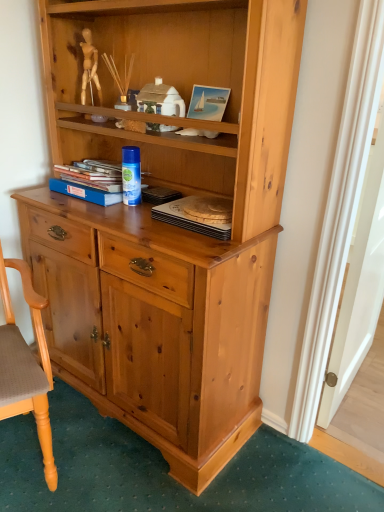
Question: From the image's perspective, is blue hardcover book at center, the 2th book positioned from the right, on wooden polished chair at lower left?

Choices:
 (A) yes
 (B) no

Answer: (A)

Question: Could you tell me if blue hardcover book at center, the 2th book positioned from the right, is facing wooden polished chair at lower left?

Choices:
 (A) yes
 (B) no

Answer: (A)

Question: Is blue hardcover book at center, the 2th book positioned from the right, at the right side of wooden polished chair at lower left?

Choices:
 (A) yes
 (B) no

Answer: (A)

Question: From a real-world perspective, is blue hardcover book at center, which is the 1th book in left-to-right order, on wooden polished chair at lower left?

Choices:
 (A) yes
 (B) no

Answer: (A)

Question: Is blue hardcover book at center, the 2th book positioned from the right, at the left side of wooden polished chair at lower left?

Choices:
 (A) yes
 (B) no

Answer: (B)

Question: Is wooden round tray at center, the second book positioned from the left, inside the boundaries of blue hardcover book at center, which is the 1th book in left-to-right order, or outside?

Choices:
 (A) inside
 (B) outside

Answer: (B)

Question: In terms of height, does wooden round tray at center, the second book positioned from the left, look taller or shorter compared to blue hardcover book at center, which is the 1th book in left-to-right order?

Choices:
 (A) short
 (B) tall

Answer: (A)

Question: From a real-world perspective, is wooden round tray at center, the second book positioned from the left, physically located above or below blue hardcover book at center, the 2th book positioned from the right?

Choices:
 (A) above
 (B) below

Answer: (B)

Question: Looking at their shapes, would you say wooden round tray at center, the 1th book viewed from the right, is wider or thinner than blue hardcover book at center, the 2th book positioned from the right?

Choices:
 (A) wide
 (B) thin

Answer: (B)

Question: Considering the positions of blue hardcover book at center, the 2th book positioned from the right, and wooden polished chair at lower left in the image, is blue hardcover book at center, the 2th book positioned from the right, taller or shorter than wooden polished chair at lower left?

Choices:
 (A) short
 (B) tall

Answer: (A)

Question: In the image, is blue hardcover book at center, which is the 1th book in left-to-right order, positioned in front of or behind wooden polished chair at lower left?

Choices:
 (A) front
 (B) behind

Answer: (B)

Question: In terms of size, does blue hardcover book at center, the 2th book positioned from the right, appear bigger or smaller than wooden polished chair at lower left?

Choices:
 (A) big
 (B) small

Answer: (B)

Question: From the image's perspective, is blue hardcover book at center, which is the 1th book in left-to-right order, above or below wooden polished chair at lower left?

Choices:
 (A) above
 (B) below

Answer: (A)

Question: Is blue hardcover book at center, the 2th book positioned from the right, wider or thinner than wooden round tray at center, the second book positioned from the left?

Choices:
 (A) thin
 (B) wide

Answer: (B)

Question: Is point (74, 180) closer or farther from the camera than point (188, 216)?

Choices:
 (A) farther
 (B) closer

Answer: (A)